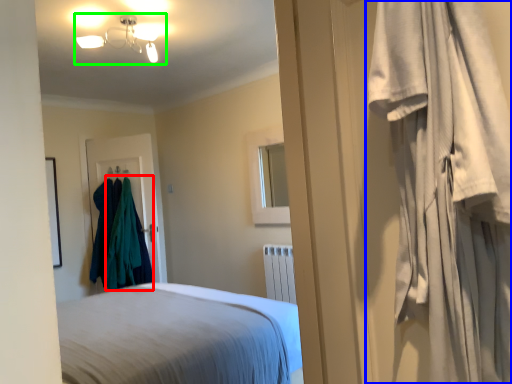
Question: Estimate the real-world distances between objects in this image. Which object is closer to clothing (highlighted by a red box), curtain (highlighted by a blue box) or lamp (highlighted by a green box)?

Choices:
 (A) curtain
 (B) lamp

Answer: (B)